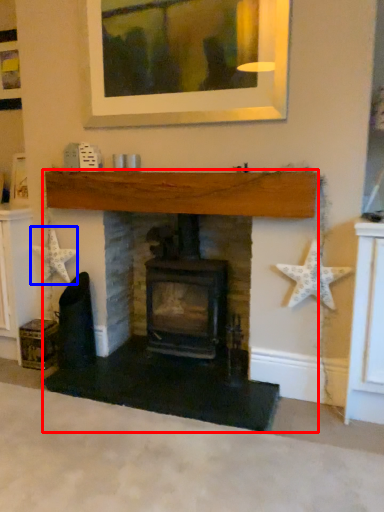
Question: Which point is closer to the camera, fireplace (highlighted by a red box) or starfish (highlighted by a blue box)?

Choices:
 (A) fireplace
 (B) starfish

Answer: (A)